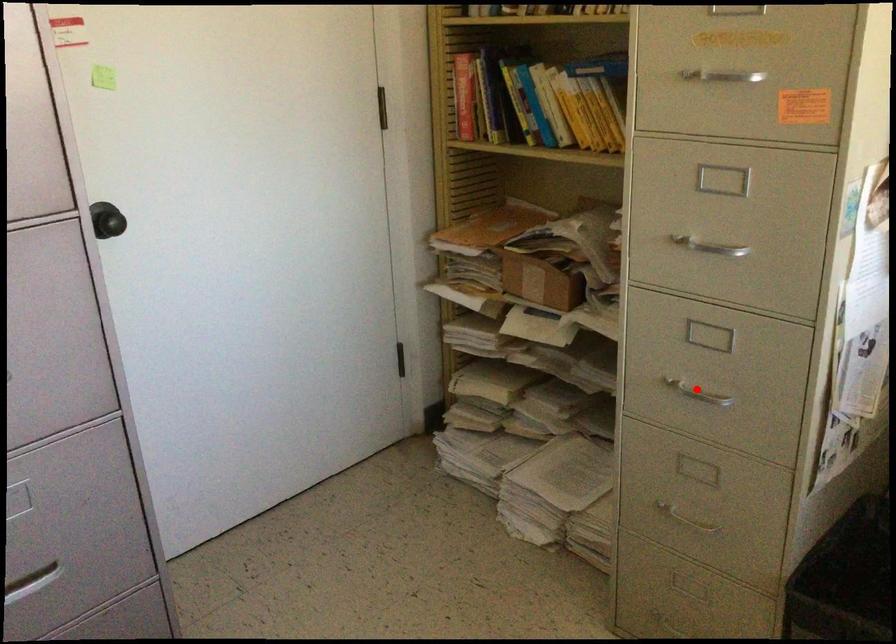
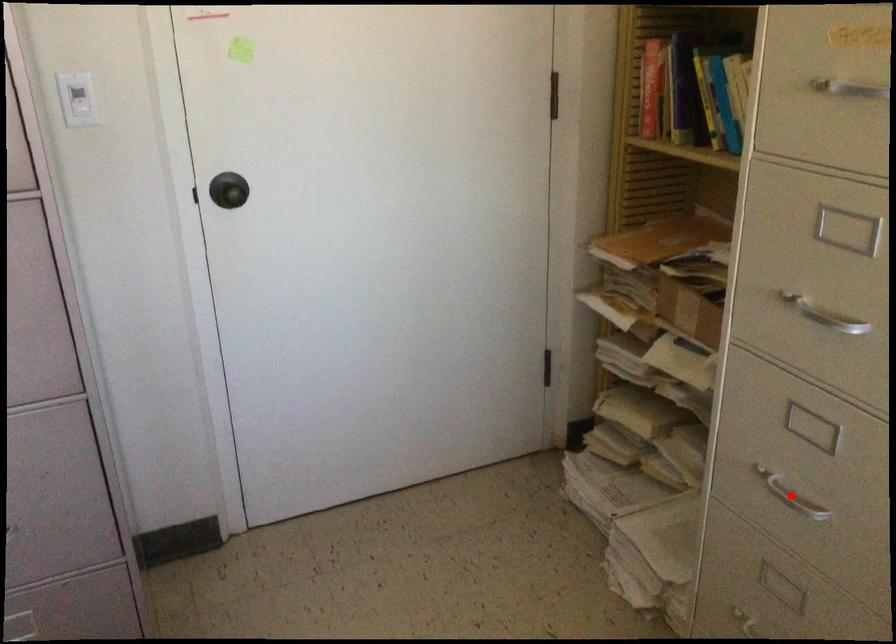
I am providing you with two images of the same scene from different viewpoints. A red point is marked on the first image and another point is marked on the second image. Is the marked point in image1 the same physical position as the marked point in image2?

Yes